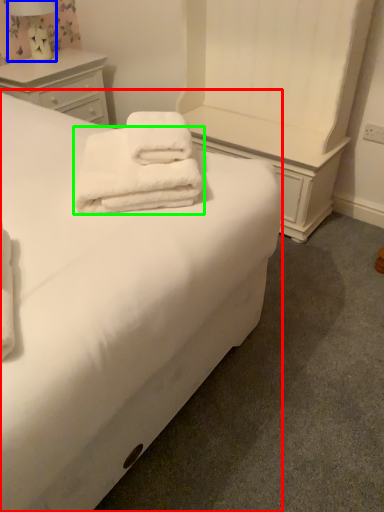
Question: Which is farther away from bed (highlighted by a red box)? bedside lamp (highlighted by a blue box) or towel (highlighted by a green box)?

Choices:
 (A) bedside lamp
 (B) towel

Answer: (A)